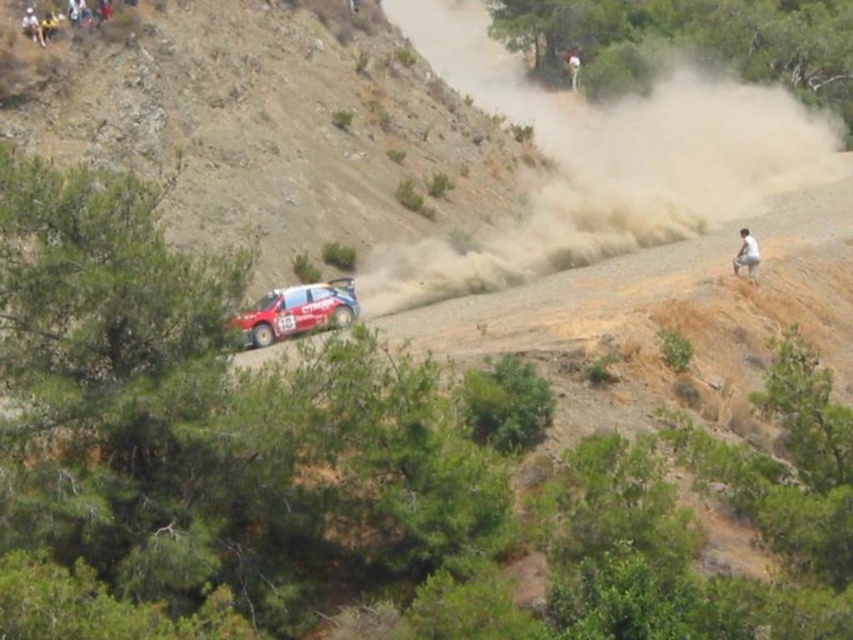
Question: Is white cotton shirt at lower right bigger than white fabric person at upper center?

Choices:
 (A) yes
 (B) no

Answer: (A)

Question: Which of the following is the closest to the observer?

Choices:
 (A) (570, 54)
 (B) (747, 273)

Answer: (B)

Question: Which point is farther to the camera?

Choices:
 (A) (740, 248)
 (B) (543, 202)
 (C) (573, 68)
 (D) (41, 35)

Answer: (C)

Question: Which of the following is the farthest from the observer?

Choices:
 (A) white fabric person at upper center
 (B) brown dusty cloud at right
 (C) red matte rally car at center
 (D) white fabric person at upper left

Answer: (A)

Question: Does brown dusty cloud at right appear over white fabric person at upper center?

Choices:
 (A) no
 (B) yes

Answer: (A)

Question: Considering the relative positions of brown dusty cloud at right and red matte rally car at center in the image provided, where is brown dusty cloud at right located with respect to red matte rally car at center?

Choices:
 (A) below
 (B) above

Answer: (B)